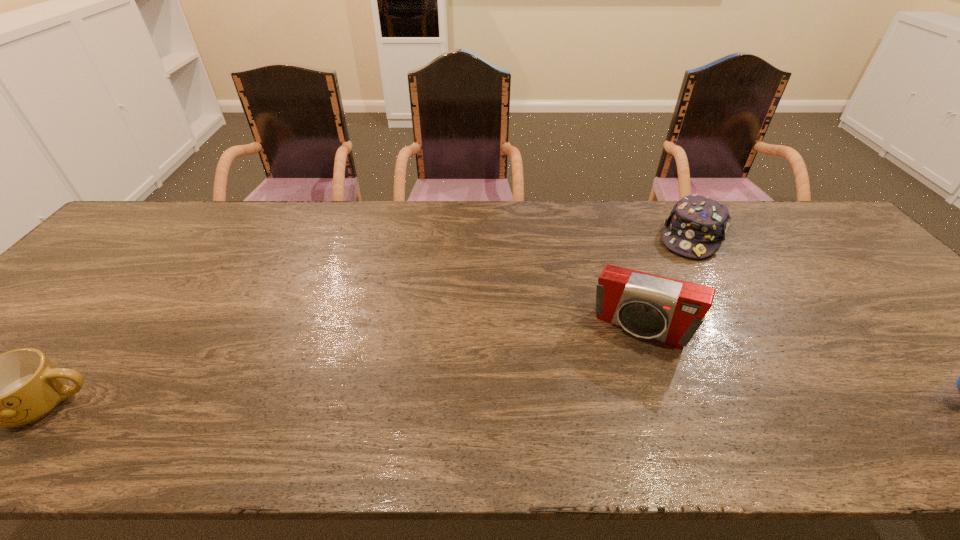
Locate an element on the screen. This screenshot has width=960, height=540. headwear is located at coordinates (696, 225).

The image size is (960, 540). In order to click on the rightmost object in this screenshot , I will do `click(696, 225)`.

Locate an element on the screen. The height and width of the screenshot is (540, 960). camera is located at coordinates (670, 311).

Locate an element on the screen. This screenshot has height=540, width=960. the tallest object is located at coordinates (670, 311).

This screenshot has width=960, height=540. Identify the location of vacant space located on the front-facing side of the farthest object. (661, 299).

I want to click on free point located on the front-facing side of the farthest object, so click(x=674, y=274).

This screenshot has height=540, width=960. Find the location of `blank space located on the front-facing side of the farthest object`. blank space located on the front-facing side of the farthest object is located at coordinates [x=662, y=297].

Image resolution: width=960 pixels, height=540 pixels. Find the location of `free location located on the front-facing side of the camera`. free location located on the front-facing side of the camera is located at coordinates click(x=607, y=392).

Where is `free region located 0.170m on the front-facing side of the camera`? The image size is (960, 540). free region located 0.170m on the front-facing side of the camera is located at coordinates (601, 406).

You are a GUI agent. You are given a task and a screenshot of the screen. Output one action in this format:
    pyautogui.click(x=<x>, y=<y>)
    Task: Click on the free region located on the front-facing side of the camera
    The width and height of the screenshot is (960, 540).
    Given the screenshot: What is the action you would take?
    pyautogui.click(x=616, y=368)